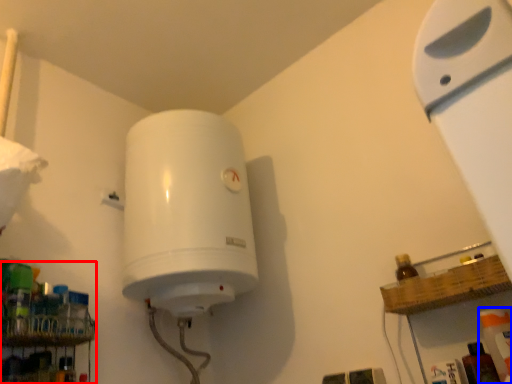
Question: Which object appears farthest to the camera in this image, shelf (highlighted by a red box) or cleaning product (highlighted by a blue box)?

Choices:
 (A) shelf
 (B) cleaning product

Answer: (A)